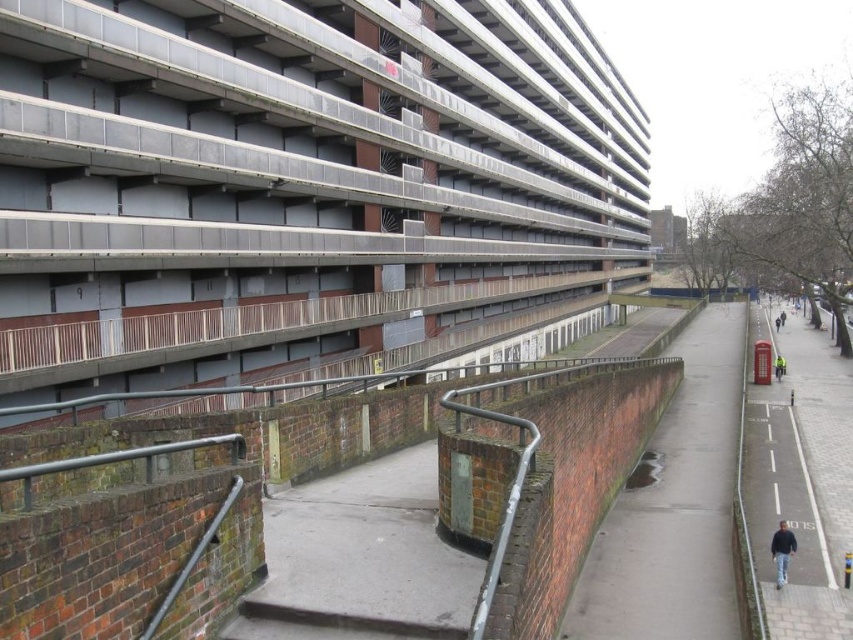
Question: Which of the following is the farthest from the observer?

Choices:
 (A) (279, 616)
 (B) (804, 604)

Answer: (B)

Question: Is concrete at center positioned at the back of concrete at lower center?

Choices:
 (A) yes
 (B) no

Answer: (A)

Question: Which object is the farthest from the dark blue jacket at lower right?

Choices:
 (A) smooth asphalt road at right
 (B) smooth concrete pavement at center
 (C) yellow reflective jacket at right
 (D) concrete at lower center

Answer: (C)

Question: Which object appears farthest from the camera in this image?

Choices:
 (A) smooth asphalt road at right
 (B) concrete at center

Answer: (A)

Question: Does dark blue jacket at lower right appear on the right side of yellow reflective jacket at right?

Choices:
 (A) no
 (B) yes

Answer: (A)

Question: Is smooth concrete pavement at center to the right of concrete at center from the viewer's perspective?

Choices:
 (A) yes
 (B) no

Answer: (A)